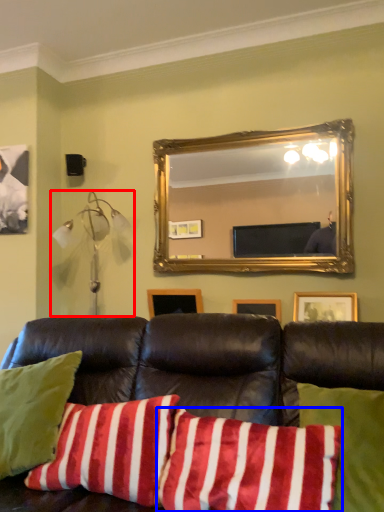
Question: Which object appears farthest to the camera in this image, lamp (highlighted by a red box) or pillow (highlighted by a blue box)?

Choices:
 (A) lamp
 (B) pillow

Answer: (A)